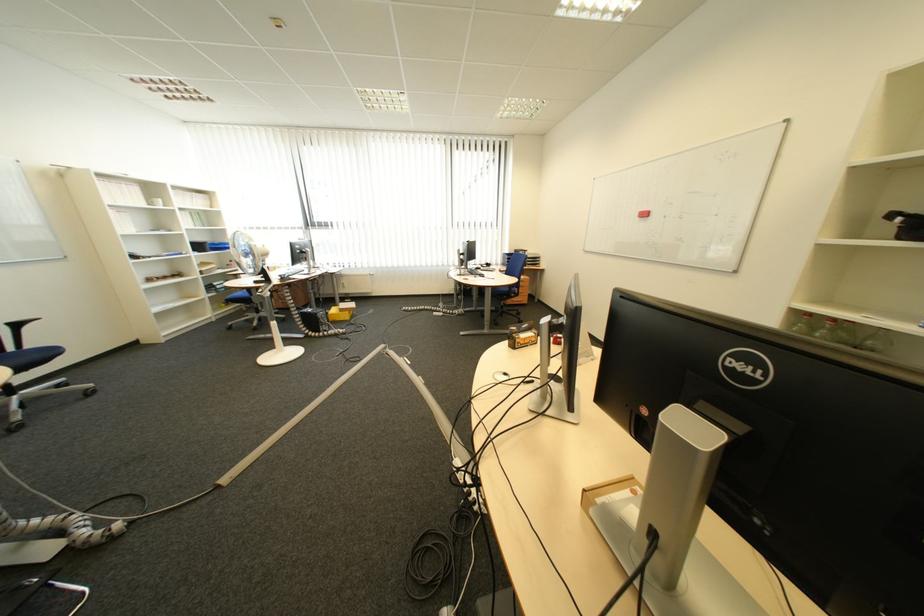
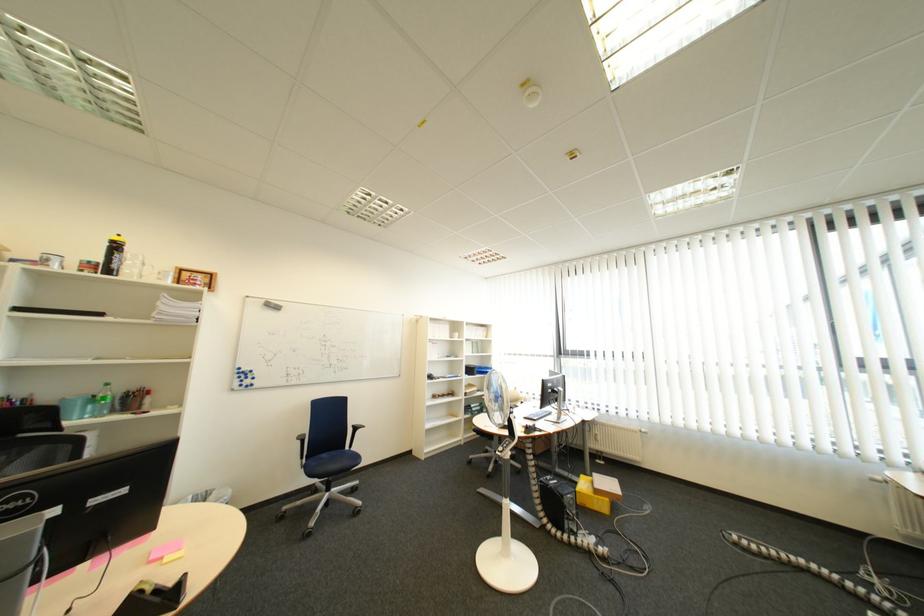
Where in the second image is the point corresponding to [315,280] from the first image?

(565, 434)